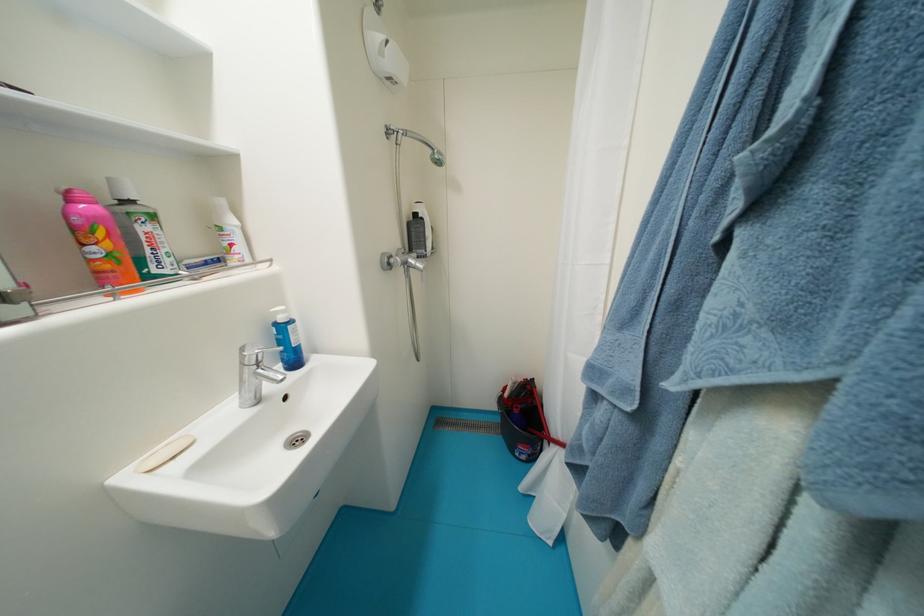
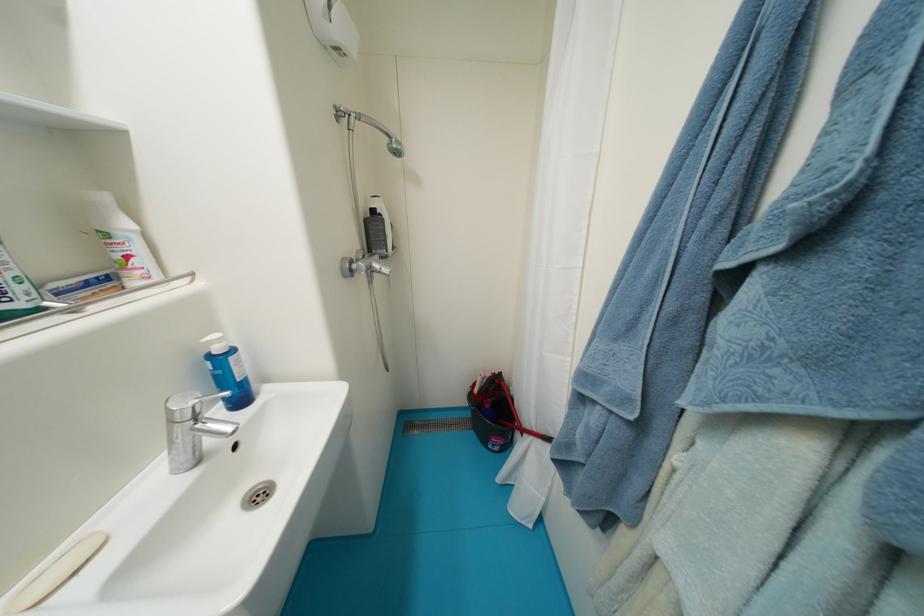
The images are taken continuously from a first-person perspective. In which direction are you moving?

The movement direction of the cameraman is left, forward.